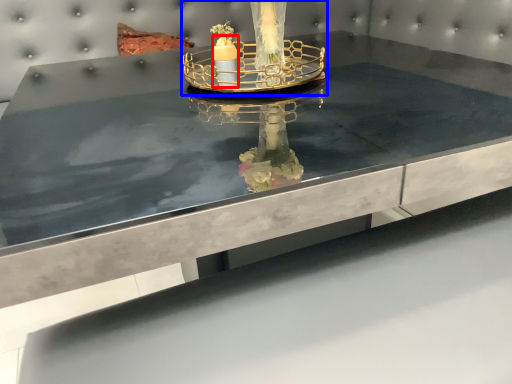
Question: Which object is closer to the camera taking this photo, candle (highlighted by a red box) or candle holder (highlighted by a blue box)?

Choices:
 (A) candle
 (B) candle holder

Answer: (B)